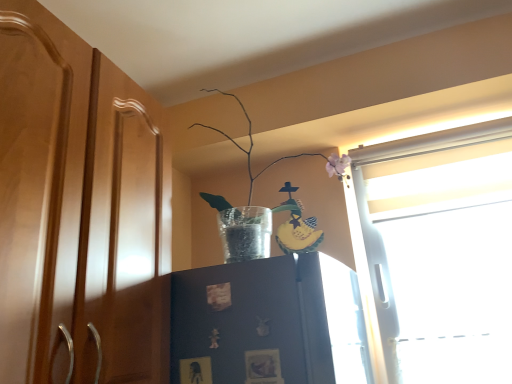
Describe the element at coordinates (253, 321) in the screenshot. The width and height of the screenshot is (512, 384). I see `matte dark blue cabinet at center` at that location.

The image size is (512, 384). What do you see at coordinates (79, 209) in the screenshot?
I see `matte wood dresser at center` at bounding box center [79, 209].

Find the location of a particular element. The image size is (512, 384). matte wood dresser at center is located at coordinates (79, 209).

Measure the distance between clear glass vase at upper center and camera.

clear glass vase at upper center is 1.34 meters from camera.

The width and height of the screenshot is (512, 384). Find the location of `matte dark blue cabinet at center`. matte dark blue cabinet at center is located at coordinates (253, 321).

Can you confirm if matte dark blue cabinet at center is thinner than clear glass vase at upper center?

Yes.

From the image's perspective, is matte dark blue cabinet at center positioned above or below clear glass vase at upper center?

matte dark blue cabinet at center is situated lower than clear glass vase at upper center in the image.

Where is `houseplant on the right of the matte dark blue cabinet at center`? The height and width of the screenshot is (384, 512). houseplant on the right of the matte dark blue cabinet at center is located at coordinates (305, 192).

From the picture: From a real-world perspective, which object rests below the other?

In real-world perspective, matte dark blue cabinet at center is lower.

Is clear glass vase at upper center completely or partially outside of matte dark blue cabinet at center?

Indeed, clear glass vase at upper center is completely outside matte dark blue cabinet at center.

In the scene shown: From the image's perspective, which is above, clear glass vase at upper center or matte dark blue cabinet at center?

clear glass vase at upper center appears higher in the image.

From the image's perspective, is matte wood dresser at center below clear glass vase at upper center?

Indeed, from the image's perspective, matte wood dresser at center is shown beneath clear glass vase at upper center.

How many degrees apart are the facing directions of matte wood dresser at center and clear glass vase at upper center?

matte wood dresser at center and clear glass vase at upper center are facing 89.6 degrees away from each other.

Looking at this image, is matte wood dresser at center inside the boundaries of clear glass vase at upper center, or outside?

matte wood dresser at center is not inside clear glass vase at upper center, it's outside.

Is matte wood dresser at center bigger than clear glass vase at upper center?

Yes.

Is there a large distance between matte dark blue cabinet at center and matte wood dresser at center?

No, matte dark blue cabinet at center is not far away from matte wood dresser at center.

Find the location of `dresser that appears above the matte dark blue cabinet at center (from the image's perspective)`. dresser that appears above the matte dark blue cabinet at center (from the image's perspective) is located at coordinates (79, 209).

Can we say matte dark blue cabinet at center lies outside matte wood dresser at center?

Yes, matte dark blue cabinet at center is outside of matte wood dresser at center.

Between matte dark blue cabinet at center and matte wood dresser at center, which one has smaller width?

matte dark blue cabinet at center.

Is clear glass vase at upper center not within matte wood dresser at center?

Yes, clear glass vase at upper center is located beyond the bounds of matte wood dresser at center.

From a real-world perspective, is clear glass vase at upper center physically below matte wood dresser at center?

No.

Is point (275, 191) behind point (49, 342)?

Yes.

From the image's perspective, who appears lower, matte wood dresser at center or matte dark blue cabinet at center?

matte dark blue cabinet at center, from the image's perspective.

Is the surface of matte wood dresser at center in direct contact with matte dark blue cabinet at center?

No.

Is matte wood dresser at center shorter than matte dark blue cabinet at center?

Incorrect, the height of matte wood dresser at center does not fall short of that of matte dark blue cabinet at center.

Who is bigger, matte wood dresser at center or matte dark blue cabinet at center?

With larger size is matte wood dresser at center.

Identify the location of houseplant lying behind the matte dark blue cabinet at center. (305, 192).

The height and width of the screenshot is (384, 512). In the image, there is a clear glass vase at upper center. In order to click on cabinetry below it (from the image's perspective) in this screenshot , I will do `click(253, 321)`.

Estimate the real-world distances between objects in this image. Which object is closer to clear glass vase at upper center, matte wood dresser at center or matte dark blue cabinet at center?

Among the two, matte dark blue cabinet at center is located nearer to clear glass vase at upper center.

Considering their positions, is clear glass vase at upper center positioned closer to matte dark blue cabinet at center than matte wood dresser at center?

matte wood dresser at center.

Which object lies nearer to the anchor point matte wood dresser at center, clear glass vase at upper center or matte dark blue cabinet at center?

matte dark blue cabinet at center lies closer to matte wood dresser at center than the other object.

In the scene shown: From the image, which object appears to be nearer to matte dark blue cabinet at center, matte wood dresser at center or clear glass vase at upper center?

Based on the image, matte wood dresser at center appears to be nearer to matte dark blue cabinet at center.

When comparing their distances from matte wood dresser at center, does matte dark blue cabinet at center or clear glass vase at upper center seem closer?

matte dark blue cabinet at center.

From the image, which object appears to be nearer to clear glass vase at upper center, matte dark blue cabinet at center or matte wood dresser at center?

matte dark blue cabinet at center is closer to clear glass vase at upper center.

The width and height of the screenshot is (512, 384). In order to click on cabinetry between matte wood dresser at center and clear glass vase at upper center from left to right in this screenshot , I will do `click(253, 321)`.